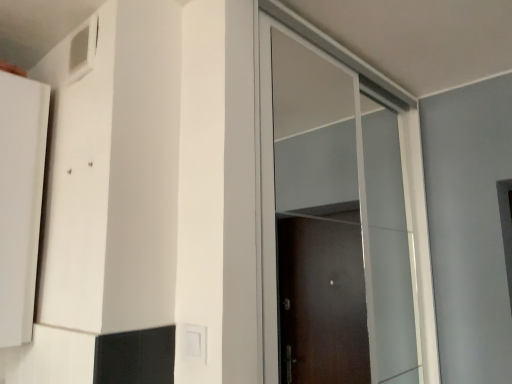
The height and width of the screenshot is (384, 512). I want to click on transparent glass screen door at center, so click(339, 189).

The height and width of the screenshot is (384, 512). What do you see at coordinates (339, 189) in the screenshot?
I see `transparent glass screen door at center` at bounding box center [339, 189].

Locate an element on the screen. transparent glass screen door at center is located at coordinates (339, 189).